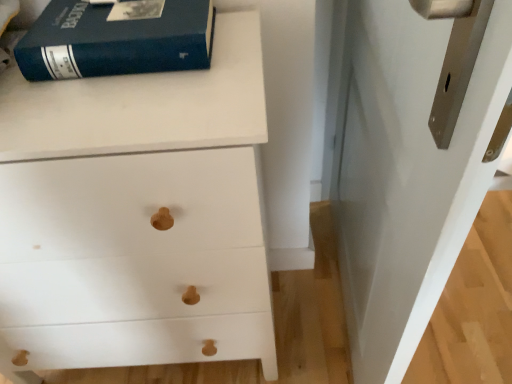
Image resolution: width=512 pixels, height=384 pixels. I want to click on matte blue book at upper left, so point(115,41).

Find the location of `white matte wood chest of drawers at upper left`. white matte wood chest of drawers at upper left is located at coordinates (136, 214).

Which object is more forward, white matte wood chest of drawers at upper left or white glossy door at upper right?

white glossy door at upper right is closer to the camera.

Is white matte wood chest of drawers at upper left surrounding white glossy door at upper right?

No, white matte wood chest of drawers at upper left does not contain white glossy door at upper right.

Is white matte wood chest of drawers at upper left turned away from white glossy door at upper right?

No.

Looking at this image, between white matte wood chest of drawers at upper left and white glossy door at upper right, which one has more height?

With more height is white glossy door at upper right.

Measure the distance between white glossy door at upper right and matte blue book at upper left.

white glossy door at upper right is 19.70 inches away from matte blue book at upper left.

How different are the orientations of white glossy door at upper right and matte blue book at upper left in degrees?

The angular difference between white glossy door at upper right and matte blue book at upper left is 79.9 degrees.

Is white glossy door at upper right in contact with matte blue book at upper left?

No, white glossy door at upper right is not touching matte blue book at upper left.

In the scene shown: From a real-world perspective, is white glossy door at upper right below matte blue book at upper left?

Indeed, from a real-world perspective, white glossy door at upper right is positioned beneath matte blue book at upper left.

From the picture: Measure the distance between matte blue book at upper left and white glossy door at upper right.

matte blue book at upper left is 19.70 inches from white glossy door at upper right.

Is white glossy door at upper right at the back of matte blue book at upper left?

No, matte blue book at upper left is not facing the opposite direction of white glossy door at upper right.

From a real-world perspective, is matte blue book at upper left positioned above or below white glossy door at upper right?

matte blue book at upper left is situated higher than white glossy door at upper right in the real world.

Which object is wider, matte blue book at upper left or white glossy door at upper right?

With larger width is matte blue book at upper left.

Is matte blue book at upper left completely or partially inside white matte wood chest of drawers at upper left?

No, white matte wood chest of drawers at upper left does not contain matte blue book at upper left.

From the image's perspective, who appears lower, white matte wood chest of drawers at upper left or matte blue book at upper left?

white matte wood chest of drawers at upper left, from the image's perspective.

Is white matte wood chest of drawers at upper left taller than matte blue book at upper left?

Yes.

Is matte blue book at upper left bigger than white matte wood chest of drawers at upper left?

No.

Is matte blue book at upper left taller or shorter than white matte wood chest of drawers at upper left?

In the image, matte blue book at upper left appears to be shorter than white matte wood chest of drawers at upper left.

The image size is (512, 384). In order to click on the chest of drawers that appears in front of the matte blue book at upper left in this screenshot , I will do `click(136, 214)`.

From a real-world perspective, which is physically below, matte blue book at upper left or white matte wood chest of drawers at upper left?

In real-world perspective, white matte wood chest of drawers at upper left is lower.

Looking at this image, which object is wider, white glossy door at upper right or white matte wood chest of drawers at upper left?

white matte wood chest of drawers at upper left is wider.

From a real-world perspective, between white glossy door at upper right and white matte wood chest of drawers at upper left, who is vertically higher?

From a 3D spatial view, white glossy door at upper right is above.

What's the angular difference between white glossy door at upper right and white matte wood chest of drawers at upper left's facing directions?

white glossy door at upper right and white matte wood chest of drawers at upper left are facing 79.9 degrees away from each other.

Between white glossy door at upper right and white matte wood chest of drawers at upper left, which one appears on the right side from the viewer's perspective?

Positioned to the right is white glossy door at upper right.

Image resolution: width=512 pixels, height=384 pixels. I want to click on door lying on the right of white matte wood chest of drawers at upper left, so click(408, 162).

At what (x,y) coordinates should I click in order to perform the action: click on door below the matte blue book at upper left (from the image's perspective). Please return your answer as a coordinate pair (x, y). This screenshot has width=512, height=384. Looking at the image, I should click on (408, 162).

When comparing their distances from matte blue book at upper left, does white glossy door at upper right or white matte wood chest of drawers at upper left seem closer?

Based on the image, white matte wood chest of drawers at upper left appears to be nearer to matte blue book at upper left.

When comparing their distances from white glossy door at upper right, does matte blue book at upper left or white matte wood chest of drawers at upper left seem further?

Based on the image, matte blue book at upper left appears to be further to white glossy door at upper right.

From the image, which object appears to be farther from white glossy door at upper right, white matte wood chest of drawers at upper left or matte blue book at upper left?

matte blue book at upper left is positioned further to the anchor white glossy door at upper right.

Looking at this image, looking at the image, which one is located closer to white matte wood chest of drawers at upper left, white glossy door at upper right or matte blue book at upper left?

Based on the image, matte blue book at upper left appears to be nearer to white matte wood chest of drawers at upper left.

When comparing their distances from white matte wood chest of drawers at upper left, does matte blue book at upper left or white glossy door at upper right seem closer?

matte blue book at upper left is closer to white matte wood chest of drawers at upper left.

Estimate the real-world distances between objects in this image. Which object is closer to matte blue book at upper left, white matte wood chest of drawers at upper left or white glossy door at upper right?

Based on the image, white matte wood chest of drawers at upper left appears to be nearer to matte blue book at upper left.

The image size is (512, 384). Find the location of `paperback book situated between white matte wood chest of drawers at upper left and white glossy door at upper right from left to right`. paperback book situated between white matte wood chest of drawers at upper left and white glossy door at upper right from left to right is located at coordinates (115, 41).